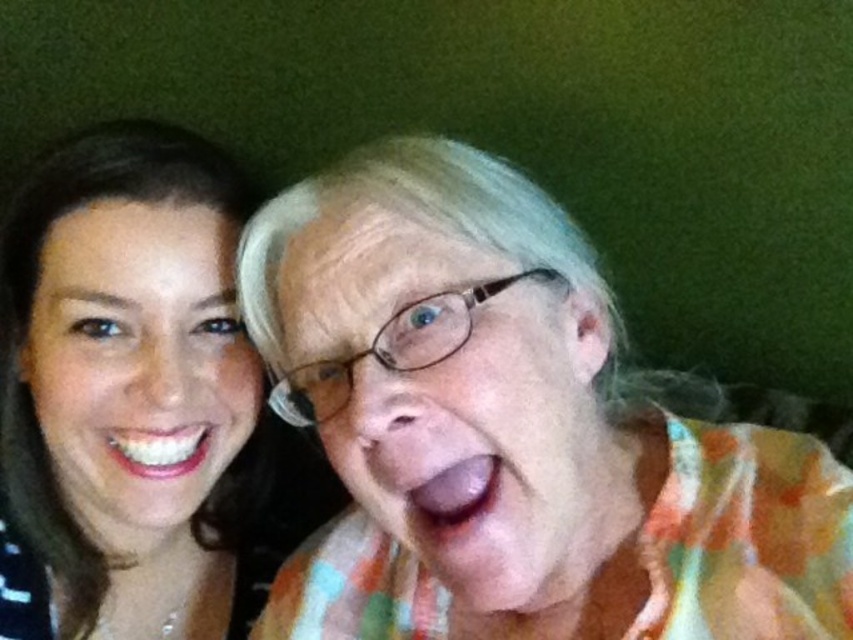
You are a photographer trying to adjust the lighting for a photo shoot. You notice the multicolored fabric at center and the matte skin face at left. Which object is located to the right of the other?

The multicolored fabric at center is positioned on the right side of matte skin face at left.

You are standing 30 inches away from the dark green wall in the image. If you want to touch the point at coordinates point (173, 372), will you be able to reach it without moving closer?

The point (173, 372) is 27.93 inches from the viewer. Since you are currently 30 inches away, you are slightly farther than the point. To reach it, you would need to move 2.07 inches closer.

You are a photographer trying to capture a group photo of two people standing in front of a dark green wall. You have a multicolored fabric at center that you want to place between them. If the two people are currently 18.95 inches apart, will the fabric fit perfectly between them without overlapping either person?

The multicolored fabric at center is exactly 18.95 inches wide, so it will fit perfectly between the two people who are 18.95 inches apart without overlapping either person.